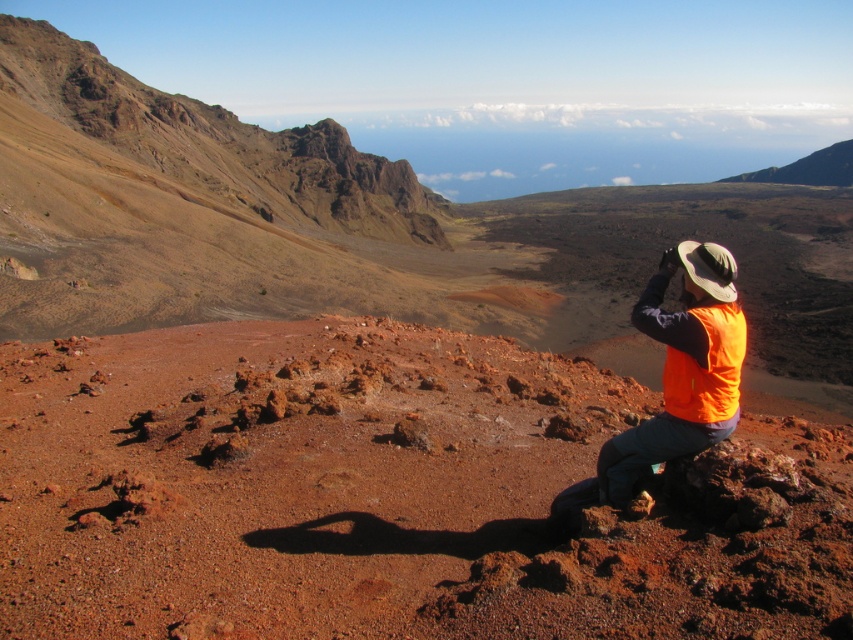
Question: Among these points, which one is farthest from the camera?

Choices:
 (A) (125, 612)
 (B) (700, 396)

Answer: (B)

Question: Does dull reddish-brown dirt at center appear over orange fabric squat at center?

Choices:
 (A) no
 (B) yes

Answer: (A)

Question: Among these objects, which one is farthest from the camera?

Choices:
 (A) orange fabric squat at center
 (B) dull reddish-brown dirt at center

Answer: (A)

Question: Does dull reddish-brown dirt at center appear on the left side of orange fabric squat at center?

Choices:
 (A) no
 (B) yes

Answer: (B)

Question: Which point is farther to the camera?

Choices:
 (A) (314, 321)
 (B) (715, 403)

Answer: (A)

Question: Is dull reddish-brown dirt at center bigger than orange fabric squat at center?

Choices:
 (A) no
 (B) yes

Answer: (B)